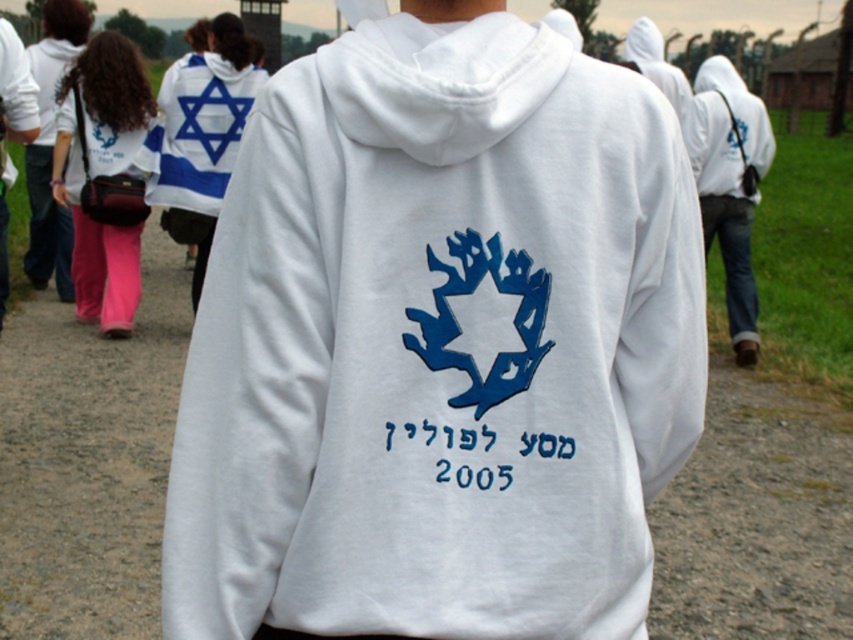
Can you confirm if matte black hoodie at left is positioned above white fleece hoodie at upper center?

Incorrect, matte black hoodie at left is not positioned above white fleece hoodie at upper center.

Between point (109, 308) and point (636, 60), which one is positioned in front?

Positioned in front is point (109, 308).

Is point (132, 173) more distant than point (635, 68)?

No, it is not.

What are the coordinates of `matte black hoodie at left` in the screenshot? It's located at (103, 177).

Does white fabric star of david at upper left have a smaller size compared to white fleece hoodie at upper center?

No.

Does point (233, 113) come in front of point (666, 68)?

Yes, it is.

Describe the element at coordinates (202, 132) in the screenshot. I see `white fabric star of david at upper left` at that location.

Identify the location of white fabric star of david at upper left. (202, 132).

Identify the location of white fleece sweatshirt at center. (438, 342).

Between point (207, 612) and point (138, 196), which one is positioned behind?

Point (138, 196)

Which is behind, point (409, 288) or point (115, 141)?

The point (115, 141) is more distant.

At what (x,y) coordinates should I click in order to perform the action: click on white fleece sweatshirt at center. Please return your answer as a coordinate pair (x, y). Looking at the image, I should click on (438, 342).